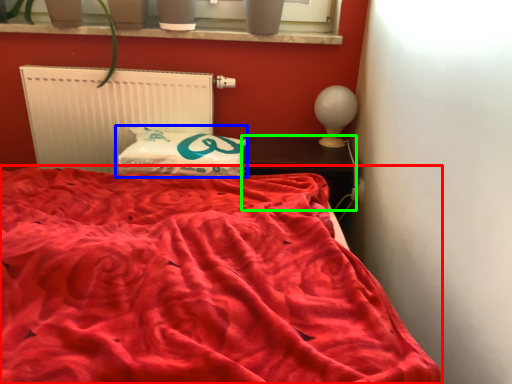
Question: Which is nearer to the bed (highlighted by a red box)? pillow (highlighted by a blue box) or furniture (highlighted by a green box).

Choices:
 (A) pillow
 (B) furniture

Answer: (A)